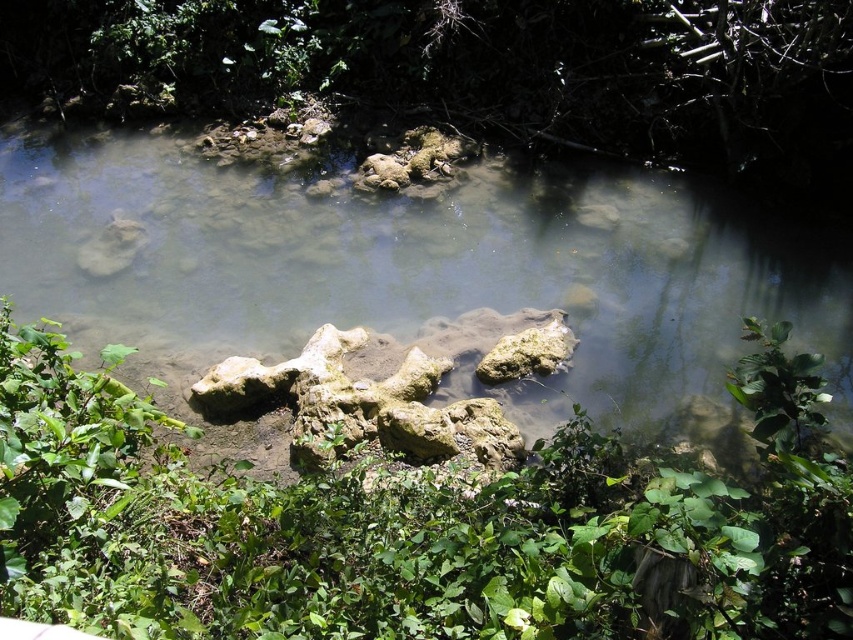
Question: Which of the following is the closest to the observer?

Choices:
 (A) green leafy vegetation at center
 (B) gray rock at center

Answer: (A)

Question: Is green leafy vegetation at center further to camera compared to gray rock at center?

Choices:
 (A) no
 (B) yes

Answer: (A)

Question: Can you confirm if green leafy vegetation at center is positioned above gray rock at center?

Choices:
 (A) no
 (B) yes

Answer: (A)

Question: Is green leafy vegetation at center wider than gray rock at center?

Choices:
 (A) no
 (B) yes

Answer: (B)

Question: Which point is farther from the camera taking this photo?

Choices:
 (A) (730, 304)
 (B) (22, 337)

Answer: (A)